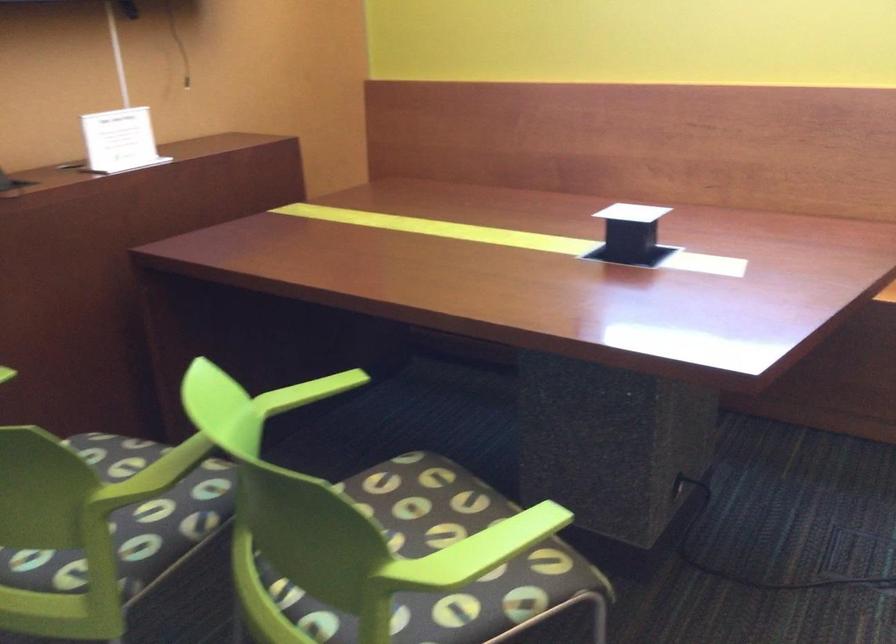
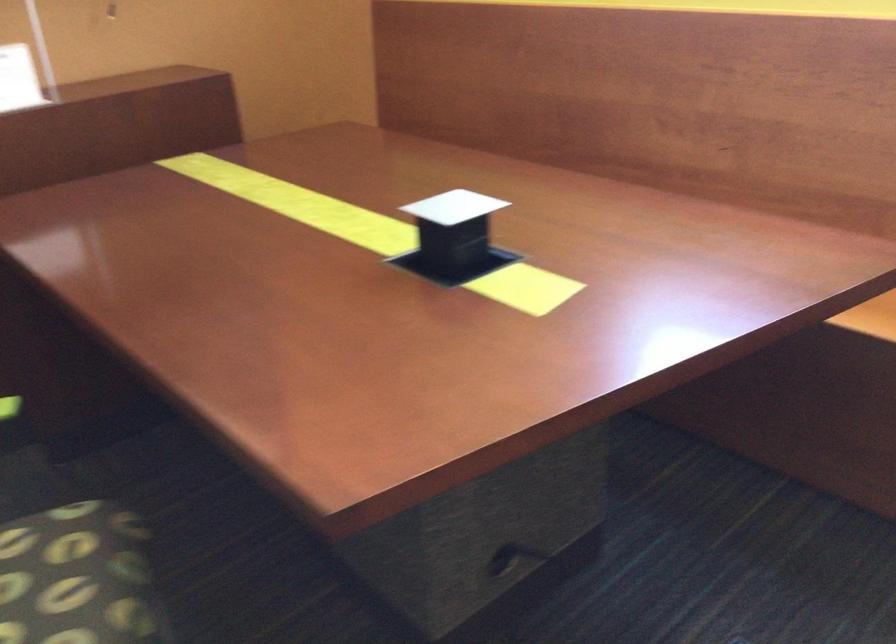
Where in the second image is the point corresponding to the point at 453,505 from the first image?

(74, 576)